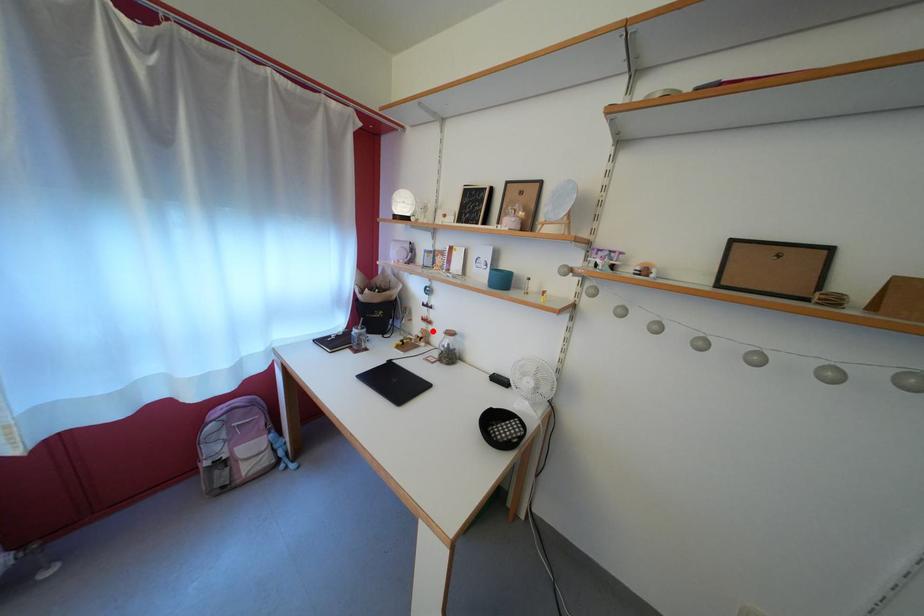
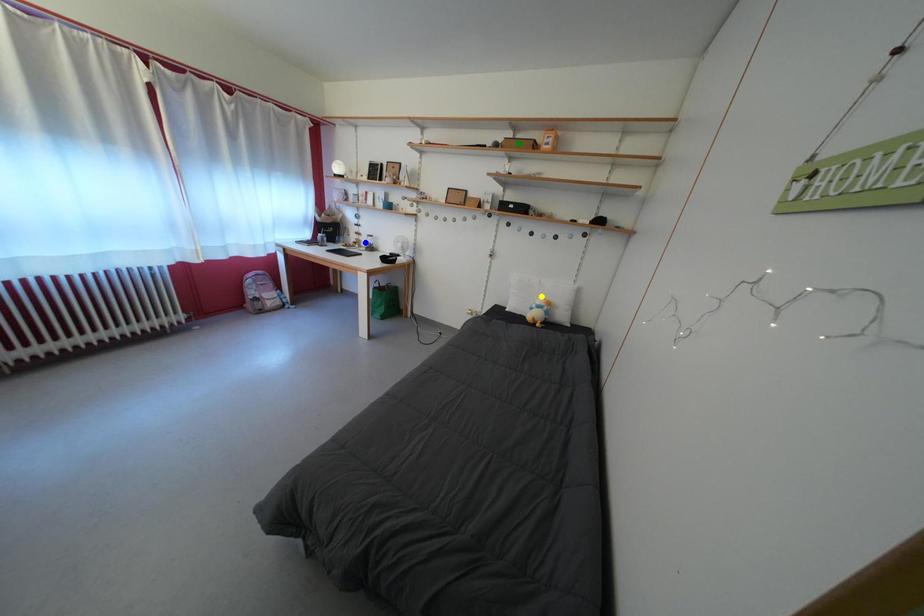
Question: I am providing you with two images of the same scene from different viewpoints. A red point is marked on the first image. You are given multiple points on the second image. Which mark in image 2 goes with the point in image 1?

Choices:
 (A) green point
 (B) yellow point
 (C) blue point

Answer: (C)